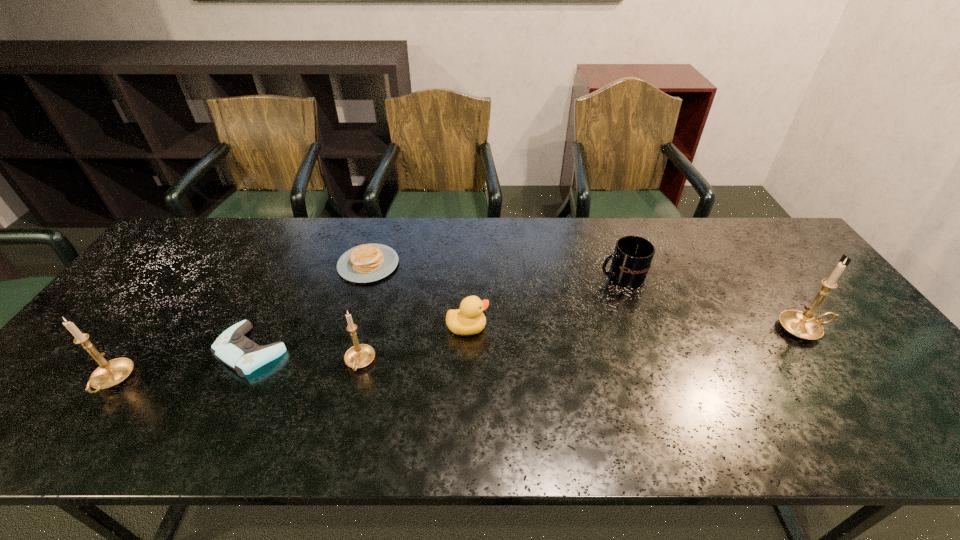
Identify the location of empty location between the fifth object from left to right and the leftmost object. pos(290,354).

You are a GUI agent. You are given a task and a screenshot of the screen. Output one action in this format:
    pyautogui.click(x=<x>, y=<y>)
    Task: Click on the free space between the sixth object from right to left and the second candle holder from left to right
    
    Given the screenshot: What is the action you would take?
    pyautogui.click(x=306, y=356)

Locate an element on the screen. unoccupied position between the mug and the fifth object from left to right is located at coordinates (544, 302).

Identify the location of empty space that is in between the pancake and the sixth object from left to right. (494, 271).

Identify the location of vacant area that lies between the shortest candle holder and the fifth object from left to right. Image resolution: width=960 pixels, height=540 pixels. (414, 345).

I want to click on free spot between the second object from left to right and the fifth shortest object, so click(x=306, y=356).

Image resolution: width=960 pixels, height=540 pixels. Identify the location of vacant space in between the rightmost object and the fifth object from left to right. (636, 328).

Where is `vacant area between the pancake and the fifth object from left to right`? The width and height of the screenshot is (960, 540). vacant area between the pancake and the fifth object from left to right is located at coordinates (418, 296).

Locate which object is the third closest to the duck. Please provide its 2D coordinates. Your answer should be formatted as a tuple, i.e. [(x, y)], where the tuple contains the x and y coordinates of a point satisfying the conditions above.

[(631, 261)]

Point out which object is positioned as the second nearest to the shortest candle holder. Please provide its 2D coordinates. Your answer should be formatted as a tuple, i.e. [(x, y)], where the tuple contains the x and y coordinates of a point satisfying the conditions above.

[(468, 320)]